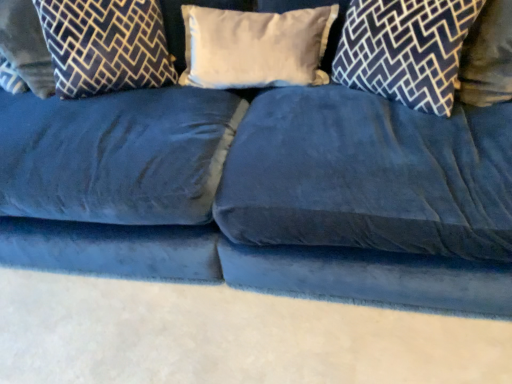
Question: Is point (81, 74) positioned closer to the camera than point (211, 18)?

Choices:
 (A) farther
 (B) closer

Answer: (B)

Question: Is dark blue velvet pillow at upper left, placed as the 3th pillow when sorted from right to left, inside or outside of white soft pillow at center, which ranks as the 3th pillow in left-to-right order?

Choices:
 (A) inside
 (B) outside

Answer: (B)

Question: Which of these objects is positioned farthest from the white soft pillow at center, which ranks as the 3th pillow in left-to-right order?

Choices:
 (A) velvet-patterned pillow at left, which ranks as the 1th pillow in left-to-right order
 (B) dark blue velvet pillow at upper right, which appears as the fourth pillow when viewed from the left
 (C) dark blue velvet pillow at upper left, placed as the 3th pillow when sorted from right to left

Answer: (A)

Question: Considering the real-world distances, which object is closest to the dark blue velvet pillow at upper left, placed as the 3th pillow when sorted from right to left?

Choices:
 (A) dark blue velvet pillow at upper right, which is the 1th pillow from right to left
 (B) white soft pillow at center, which ranks as the 3th pillow in left-to-right order
 (C) velvet-patterned pillow at left, positioned as the fourth pillow in right-to-left order

Answer: (C)